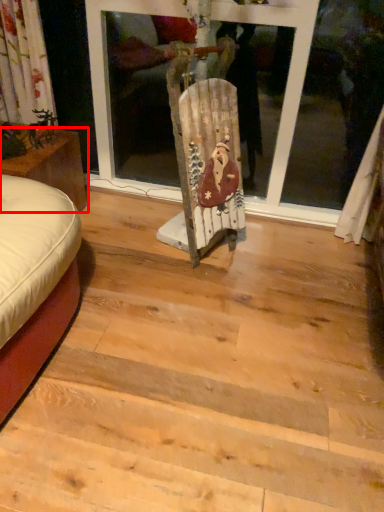
Question: Considering the relative positions of furniture (annotated by the red box) and art in the image provided, where is furniture (annotated by the red box) located with respect to the staircase?

Choices:
 (A) right
 (B) left

Answer: (B)